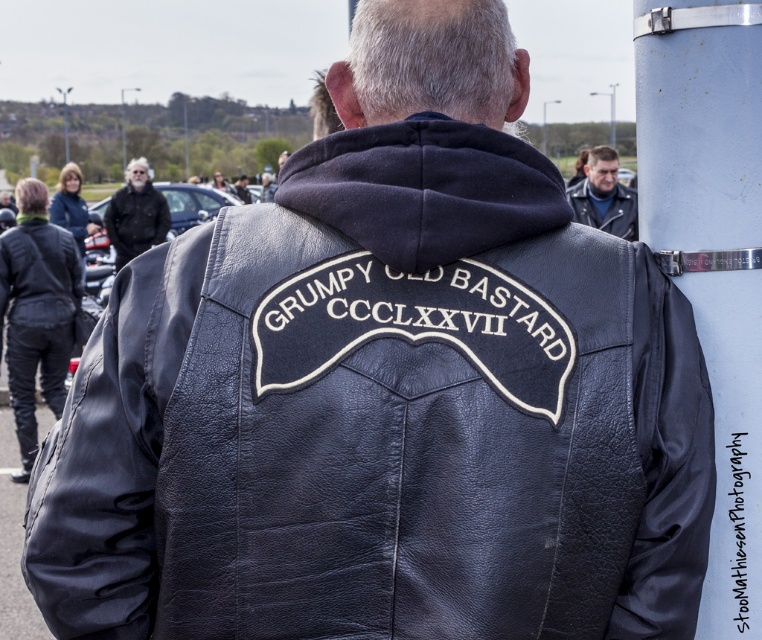
Identify the location of black leather jacket at left. This screenshot has height=640, width=762. (37, 310).

Which is more to the left, black leather jacket at left or black leather jacket at upper left?

From the viewer's perspective, black leather jacket at upper left appears more on the left side.

I want to click on black leather jacket at left, so click(37, 310).

Locate an element on the screen. This screenshot has height=640, width=762. black leather jacket at left is located at coordinates (37, 310).

Who is taller, black leather jacket at center or leather jacket at upper center?

leather jacket at upper center is taller.

Can you confirm if black leather jacket at center is positioned below leather jacket at upper center?

Yes, black leather jacket at center is below leather jacket at upper center.

The image size is (762, 640). What do you see at coordinates (111, 458) in the screenshot?
I see `black leather jacket at center` at bounding box center [111, 458].

Where is `black leather jacket at center`? Image resolution: width=762 pixels, height=640 pixels. black leather jacket at center is located at coordinates point(111,458).

Can you confirm if black leather jacket at upper left is wider than gray hair at upper left?

Incorrect, black leather jacket at upper left's width does not surpass gray hair at upper left's.

Who is lower down, black leather jacket at upper left or gray hair at upper left?

black leather jacket at upper left is lower down.

Is point (74, 269) less distant than point (139, 228)?

That is True.

You are a GUI agent. You are given a task and a screenshot of the screen. Output one action in this format:
    pyautogui.click(x=<x>, y=<y>)
    Task: Click on the black leather jacket at upper left
    
    Given the screenshot: What is the action you would take?
    coord(37,275)